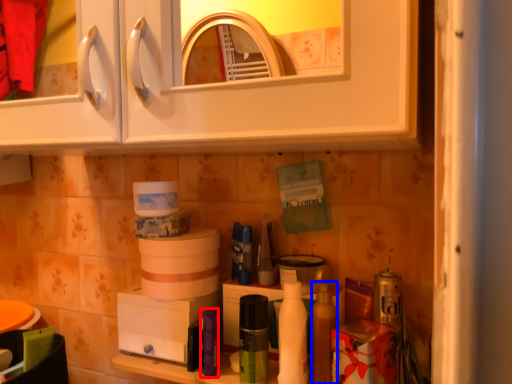
Question: Which point is closer to the camera, toiletry (highlighted by a red box) or toiletry (highlighted by a blue box)?

Choices:
 (A) toiletry
 (B) toiletry

Answer: (B)